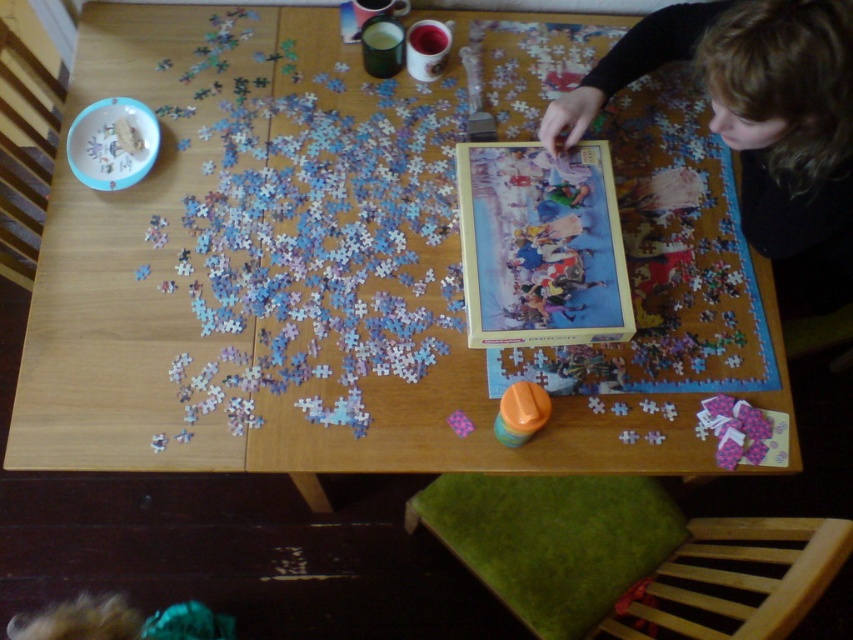
Where is the wooden table at center located in the image?

The wooden table at center is located at point (289,280) in the image.

Based on the photo, you are organizing a puzzle party and need to ensure there is enough space for guests to work. Given that the wooden table at center and the blonde hair at upper right are present, which object would allow more people to gather around it?

The wooden table at center is bigger than the blonde hair at upper right, so more people can gather around the wooden table at center.